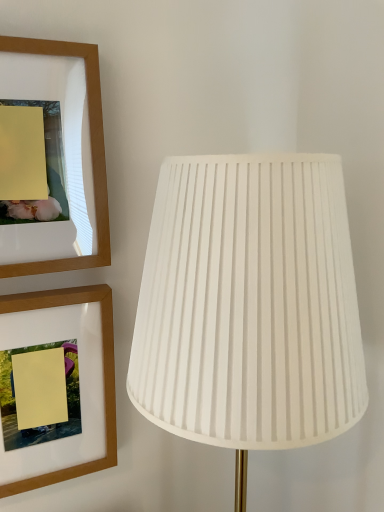
At what (x,y) coordinates should I click in order to perform the action: click on wooden picture frame at upper left, positioned as the first picture frame in top-to-bottom order. Please return your answer as a coordinate pair (x, y). The image size is (384, 512). Looking at the image, I should click on (91, 153).

In order to face wooden picture frame at upper left, which is the first picture frame in bottom-to-top order, should I rotate leftwards or rightwards?

You should look left and rotate roughly 19.945 degrees.

Where is `wooden picture frame at upper left, the 2th picture frame positioned from the bottom`? This screenshot has width=384, height=512. wooden picture frame at upper left, the 2th picture frame positioned from the bottom is located at coordinates 91,153.

From a real-world perspective, is white pleated fabric lamp at right physically above wooden picture frame at upper left, positioned as the first picture frame in top-to-bottom order?

Actually, white pleated fabric lamp at right is physically below wooden picture frame at upper left, positioned as the first picture frame in top-to-bottom order, in the real world.

Consider the image. Is the surface of white pleated fabric lamp at right in direct contact with wooden picture frame at upper left, positioned as the first picture frame in top-to-bottom order?

white pleated fabric lamp at right and wooden picture frame at upper left, positioned as the first picture frame in top-to-bottom order, are not in contact.

In the scene shown: Which object is thinner, white pleated fabric lamp at right or wooden picture frame at upper left, the 2th picture frame positioned from the bottom?

With smaller width is wooden picture frame at upper left, the 2th picture frame positioned from the bottom.

Consider the image. Is wooden picture frame at upper left, which is the second picture frame from top to bottom, at the back of wooden picture frame at upper left, positioned as the first picture frame in top-to-bottom order?

wooden picture frame at upper left, positioned as the first picture frame in top-to-bottom order, does not have its back to wooden picture frame at upper left, which is the second picture frame from top to bottom.

Based on the photo, which of these two, wooden picture frame at upper left, positioned as the first picture frame in top-to-bottom order, or wooden picture frame at upper left, which is the second picture frame from top to bottom, stands taller?

Standing taller between the two is wooden picture frame at upper left, which is the second picture frame from top to bottom.

From the image's perspective, between wooden picture frame at upper left, positioned as the first picture frame in top-to-bottom order, and wooden picture frame at upper left, which is the second picture frame from top to bottom, who is located below?

wooden picture frame at upper left, which is the second picture frame from top to bottom, from the image's perspective.

Can you confirm if wooden picture frame at upper left, the 2th picture frame positioned from the bottom, is thinner than wooden picture frame at upper left, which is the first picture frame in bottom-to-top order?

Correct, the width of wooden picture frame at upper left, the 2th picture frame positioned from the bottom, is less than that of wooden picture frame at upper left, which is the first picture frame in bottom-to-top order.

From the image's perspective, would you say wooden picture frame at upper left, which is the second picture frame from top to bottom, is positioned over wooden picture frame at upper left, the 2th picture frame positioned from the bottom?

No, from the image's perspective, wooden picture frame at upper left, which is the second picture frame from top to bottom, is not above wooden picture frame at upper left, the 2th picture frame positioned from the bottom.

Would you say wooden picture frame at upper left, which is the first picture frame in bottom-to-top order, contains wooden picture frame at upper left, the 2th picture frame positioned from the bottom?

No.

Is wooden picture frame at upper left, which is the first picture frame in bottom-to-top order, further to camera compared to wooden picture frame at upper left, the 2th picture frame positioned from the bottom?

Yes, wooden picture frame at upper left, which is the first picture frame in bottom-to-top order, is further from the camera.

Does point (93, 286) come farther from viewer compared to point (103, 187)?

That is True.

Considering the sizes of wooden picture frame at upper left, which is the first picture frame in bottom-to-top order, and white pleated fabric lamp at right in the image, is wooden picture frame at upper left, which is the first picture frame in bottom-to-top order, wider or thinner than white pleated fabric lamp at right?

Clearly, wooden picture frame at upper left, which is the first picture frame in bottom-to-top order, has less width compared to white pleated fabric lamp at right.

From the image's perspective, between wooden picture frame at upper left, which is the second picture frame from top to bottom, and white pleated fabric lamp at right, who is located below?

white pleated fabric lamp at right appears lower in the image.

From the picture: Is wooden picture frame at upper left, which is the second picture frame from top to bottom, bigger than white pleated fabric lamp at right?

Incorrect, wooden picture frame at upper left, which is the second picture frame from top to bottom, is not larger than white pleated fabric lamp at right.

Relative to white pleated fabric lamp at right, is wooden picture frame at upper left, positioned as the first picture frame in top-to-bottom order, in front or behind?

wooden picture frame at upper left, positioned as the first picture frame in top-to-bottom order, is positioned farther from the viewer than white pleated fabric lamp at right.

Is point (103, 231) positioned after point (156, 403)?

That is True.

Is wooden picture frame at upper left, the 2th picture frame positioned from the bottom, directly adjacent to white pleated fabric lamp at right?

No, wooden picture frame at upper left, the 2th picture frame positioned from the bottom, is not next to white pleated fabric lamp at right.

Is wooden picture frame at upper left, the 2th picture frame positioned from the bottom, smaller than white pleated fabric lamp at right?

Correct, wooden picture frame at upper left, the 2th picture frame positioned from the bottom, occupies less space than white pleated fabric lamp at right.

Considering the positions of objects white pleated fabric lamp at right and wooden picture frame at upper left, which is the second picture frame from top to bottom, in the image provided, who is behind, white pleated fabric lamp at right or wooden picture frame at upper left, which is the second picture frame from top to bottom,?

wooden picture frame at upper left, which is the second picture frame from top to bottom, is further away from the camera.

Who is shorter, white pleated fabric lamp at right or wooden picture frame at upper left, which is the second picture frame from top to bottom?

wooden picture frame at upper left, which is the second picture frame from top to bottom, is shorter.

Measure the distance between white pleated fabric lamp at right and wooden picture frame at upper left, which is the second picture frame from top to bottom.

white pleated fabric lamp at right and wooden picture frame at upper left, which is the second picture frame from top to bottom, are 10.98 inches apart.

From the image's perspective, which object appears higher, white pleated fabric lamp at right or wooden picture frame at upper left, which is the second picture frame from top to bottom?

wooden picture frame at upper left, which is the second picture frame from top to bottom, appears higher in the image.

This screenshot has height=512, width=384. There is a white pleated fabric lamp at right. Find the location of `the 2nd picture frame above it (from a real-world perspective)`. the 2nd picture frame above it (from a real-world perspective) is located at coordinates (91, 153).

Where is `picture frame that appears below the wooden picture frame at upper left, the 2th picture frame positioned from the bottom (from the image's perspective)`? picture frame that appears below the wooden picture frame at upper left, the 2th picture frame positioned from the bottom (from the image's perspective) is located at coordinates (103, 371).

Which object lies nearer to the anchor point wooden picture frame at upper left, which is the first picture frame in bottom-to-top order, white pleated fabric lamp at right or wooden picture frame at upper left, positioned as the first picture frame in top-to-bottom order?

wooden picture frame at upper left, positioned as the first picture frame in top-to-bottom order.

Which object lies further to the anchor point white pleated fabric lamp at right, wooden picture frame at upper left, the 2th picture frame positioned from the bottom, or wooden picture frame at upper left, which is the second picture frame from top to bottom?

The object further to white pleated fabric lamp at right is wooden picture frame at upper left, which is the second picture frame from top to bottom.

Based on their spatial positions, is wooden picture frame at upper left, which is the first picture frame in bottom-to-top order, or wooden picture frame at upper left, positioned as the first picture frame in top-to-bottom order, further from white pleated fabric lamp at right?

The object further to white pleated fabric lamp at right is wooden picture frame at upper left, which is the first picture frame in bottom-to-top order.

Considering their positions, is white pleated fabric lamp at right positioned further to wooden picture frame at upper left, positioned as the first picture frame in top-to-bottom order, than wooden picture frame at upper left, which is the first picture frame in bottom-to-top order?

Based on the image, white pleated fabric lamp at right appears to be further to wooden picture frame at upper left, positioned as the first picture frame in top-to-bottom order.

Estimate the real-world distances between objects in this image. Which object is further from wooden picture frame at upper left, which is the second picture frame from top to bottom, wooden picture frame at upper left, the 2th picture frame positioned from the bottom, or white pleated fabric lamp at right?

white pleated fabric lamp at right is further to wooden picture frame at upper left, which is the second picture frame from top to bottom.

When comparing their distances from wooden picture frame at upper left, the 2th picture frame positioned from the bottom, does wooden picture frame at upper left, which is the second picture frame from top to bottom, or white pleated fabric lamp at right seem further?

The object further to wooden picture frame at upper left, the 2th picture frame positioned from the bottom, is white pleated fabric lamp at right.

Identify the location of picture frame between wooden picture frame at upper left, the 2th picture frame positioned from the bottom, and white pleated fabric lamp at right from top to bottom. (103, 371).